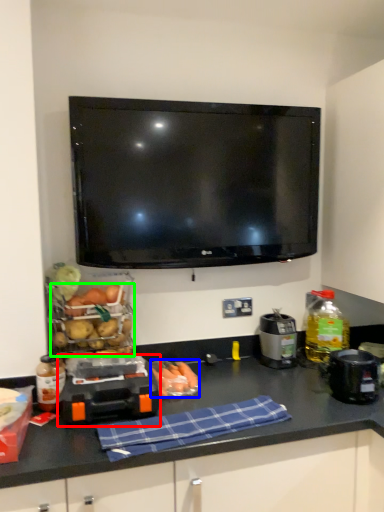
Question: Which object is positioned closest to appliance (highlighted by a red box)? Select from food (highlighted by a blue box) and food (highlighted by a green box).

Choices:
 (A) food
 (B) food

Answer: (A)